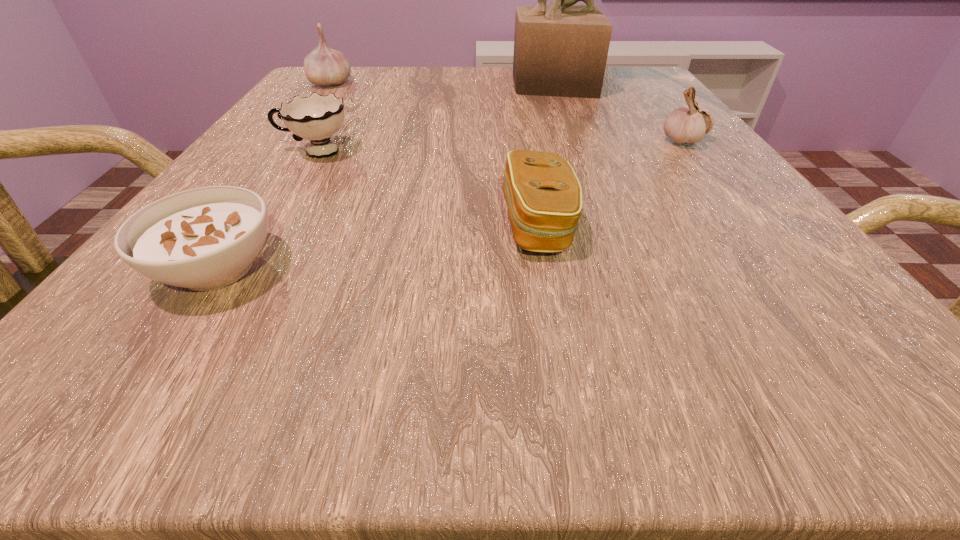
This screenshot has width=960, height=540. I want to click on vacant area between the clutch bag and the nearer garlic, so click(611, 183).

In order to click on free area in between the cup and the clutch bag in this screenshot , I will do `click(426, 188)`.

You are a GUI agent. You are given a task and a screenshot of the screen. Output one action in this format:
    pyautogui.click(x=<x>, y=<y>)
    Task: Click on the vacant area that lies between the clutch bag and the soup bowl
    
    Given the screenshot: What is the action you would take?
    pyautogui.click(x=377, y=246)

You are a GUI agent. You are given a task and a screenshot of the screen. Output one action in this format:
    pyautogui.click(x=<x>, y=<y>)
    Task: Click on the unoccupied area between the second tallest object and the soup bowl
    
    Given the screenshot: What is the action you would take?
    pyautogui.click(x=275, y=176)

Locate an element on the screen. This screenshot has height=540, width=960. free space between the cup and the tallest object is located at coordinates (434, 118).

Find the location of `free space between the right garlic and the soup bowl`. free space between the right garlic and the soup bowl is located at coordinates (451, 205).

I want to click on empty location between the soup bowl and the farther garlic, so click(275, 176).

This screenshot has width=960, height=540. In order to click on object that can be found as the third closest to the clutch bag in this screenshot , I will do `click(202, 239)`.

This screenshot has width=960, height=540. What are the coordinates of `object that is the nearest to the second tallest object` in the screenshot? It's located at (316, 118).

At what (x,y) coordinates should I click in order to perform the action: click on vacant space that satisfies the following two spatial constraints: 1. on the side of the cup with the handle; 2. on the right side of the nearer garlic. Please return your answer as a coordinate pair (x, y). Looking at the image, I should click on (323, 141).